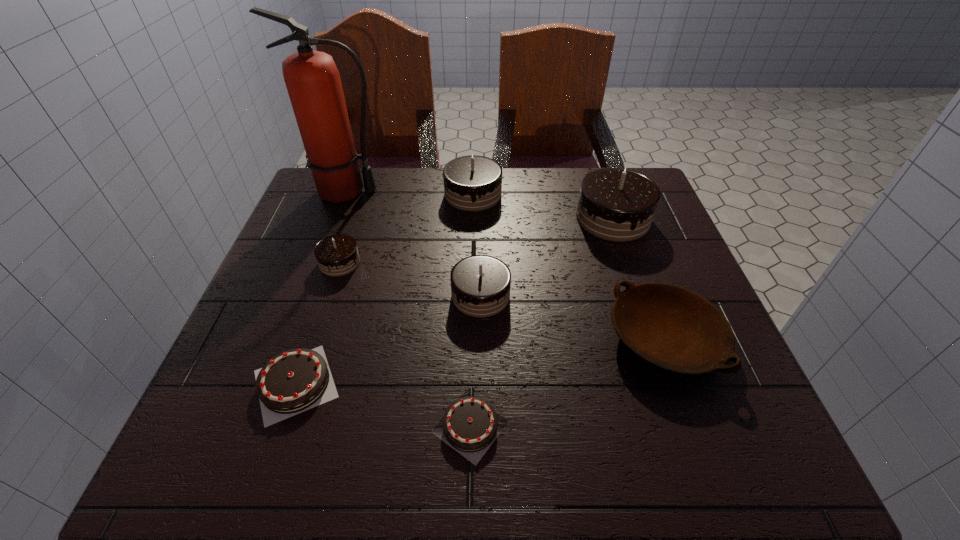
The image size is (960, 540). In order to click on brown plate in this screenshot , I will do `click(674, 329)`.

Where is `the left brown chocolate cake`? the left brown chocolate cake is located at coordinates pyautogui.click(x=296, y=380).

Find the location of a particular element. The height and width of the screenshot is (540, 960). the bigger brown chocolate cake is located at coordinates (296, 380).

You are a GUI agent. You are given a task and a screenshot of the screen. Output one action in this format:
    pyautogui.click(x=<x>, y=<y>)
    Task: Click on the shortest chocolate cake
    The width and height of the screenshot is (960, 540).
    Given the screenshot: What is the action you would take?
    pyautogui.click(x=470, y=423)

Find the location of a particular element. the shortest object is located at coordinates (470, 423).

This screenshot has height=540, width=960. I want to click on vacant space located 0.290m on the nozzle of the fire extinguisher, so click(494, 191).

Where is `vacant space positioned on the back of the rightmost chocolate chocolate cake`? The width and height of the screenshot is (960, 540). vacant space positioned on the back of the rightmost chocolate chocolate cake is located at coordinates (600, 183).

The image size is (960, 540). In order to click on free space located 0.300m on the front of the second tallest chocolate cake in this screenshot , I will do `click(471, 300)`.

The height and width of the screenshot is (540, 960). In order to click on free point located 0.160m on the front of the fourth shortest chocolate cake in this screenshot , I will do `click(481, 390)`.

You are a GUI agent. You are given a task and a screenshot of the screen. Output one action in this format:
    pyautogui.click(x=<x>, y=<y>)
    Task: Click on the vacant area located 0.370m on the right of the smallest chocolate chocolate cake
    
    Given the screenshot: What is the action you would take?
    pyautogui.click(x=527, y=262)